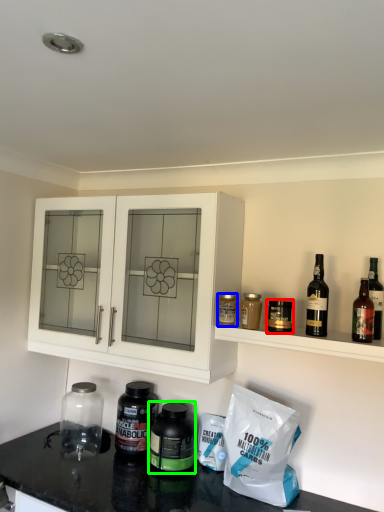
Question: Estimate the real-world distances between objects in this image. Which object is farther from bottle (highlighted by a red box), bottle (highlighted by a blue box) or bottle (highlighted by a green box)?

Choices:
 (A) bottle
 (B) bottle

Answer: (B)